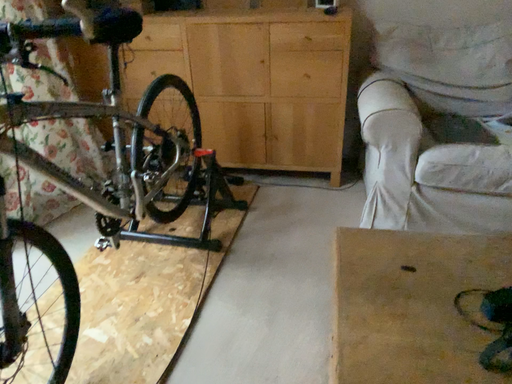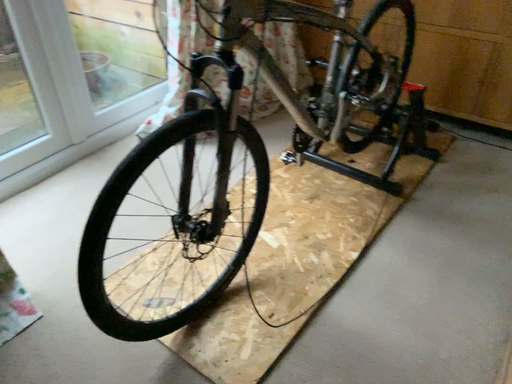
Question: Which way did the camera rotate in the video?

Choices:
 (A) rotated right
 (B) rotated left

Answer: (B)